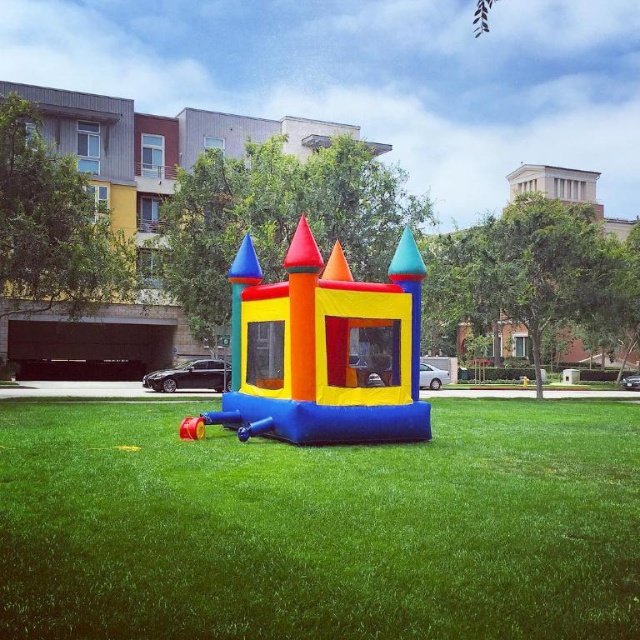
Question: Which point is farther to the camera?

Choices:
 (A) [x=289, y=396]
 (B) [x=170, y=554]

Answer: (A)

Question: Is blue rubber bouncy castle at center to the left of inflatable castle at center from the viewer's perspective?

Choices:
 (A) no
 (B) yes

Answer: (B)

Question: Can you confirm if blue rubber bouncy castle at center is positioned to the right of inflatable castle at center?

Choices:
 (A) yes
 (B) no

Answer: (B)

Question: Can you confirm if blue rubber bouncy castle at center is wider than inflatable castle at center?

Choices:
 (A) no
 (B) yes

Answer: (B)

Question: Which point is farther to the camera?

Choices:
 (A) blue rubber bouncy castle at center
 (B) inflatable castle at center

Answer: (B)

Question: Which point appears closest to the camera in this image?

Choices:
 (A) (385, 616)
 (B) (404, 285)

Answer: (A)